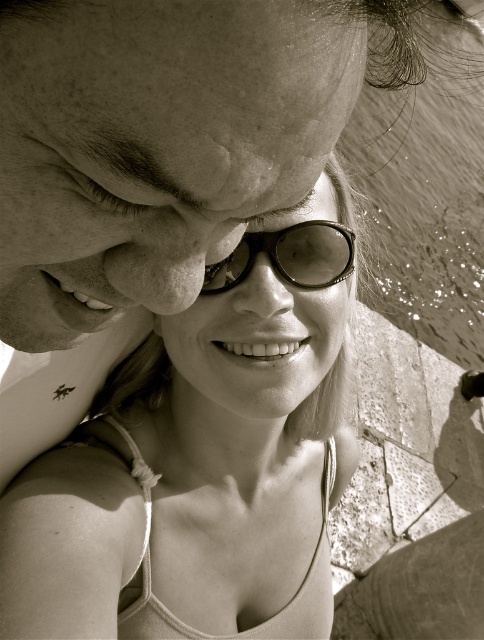
You are a photographer checking the composition of this image. You notice the matte black sunglasses at center and the smooth skin forehead at upper center. Which object is wider in the image?

The matte black sunglasses at center might be wider than smooth skin forehead at upper center according to the description.